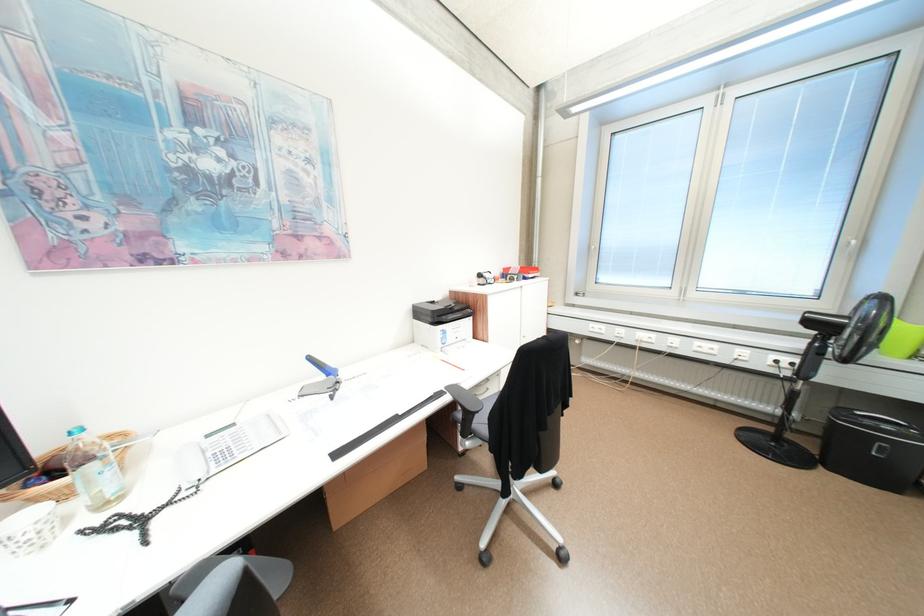
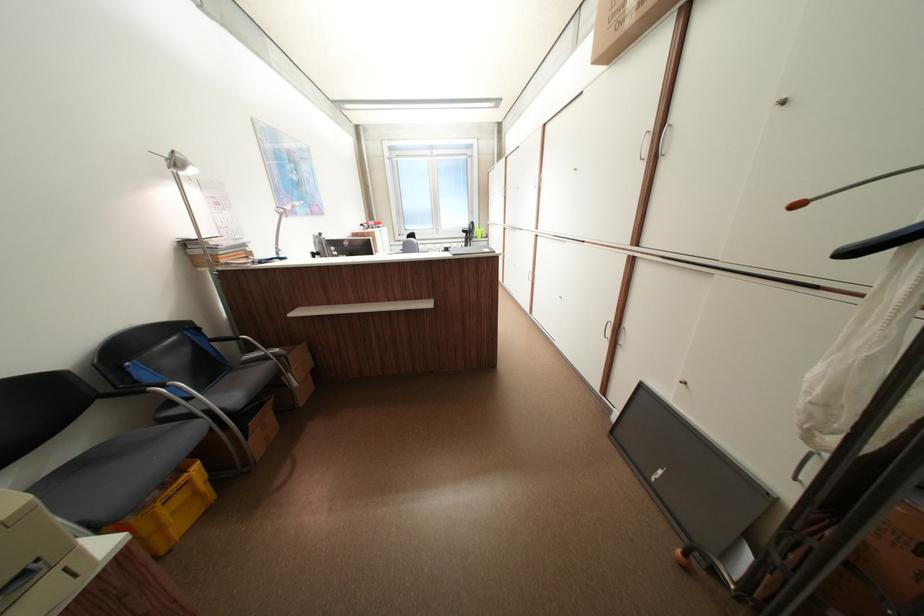
Question: I am providing you with two images of the same scene from different viewpoints. Which of the following objects are not visible in image2?

Choices:
 (A) yellow plastic crate
 (B) telephone handset
 (C) blue rolled-up mat
 (D) black clothes hanger

Answer: (B)